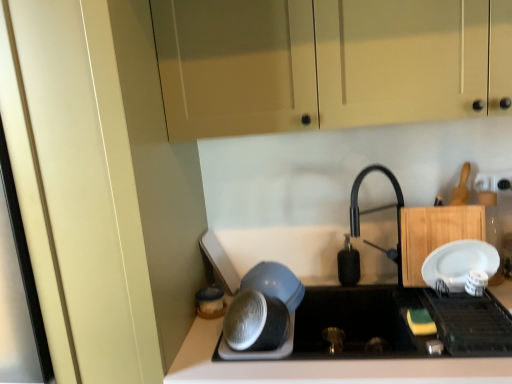
Locate an element on the screen. The height and width of the screenshot is (384, 512). free space to the left of black matte soap dispenser at center, marked as the third appliance in a left-to-right arrangement is located at coordinates (320, 283).